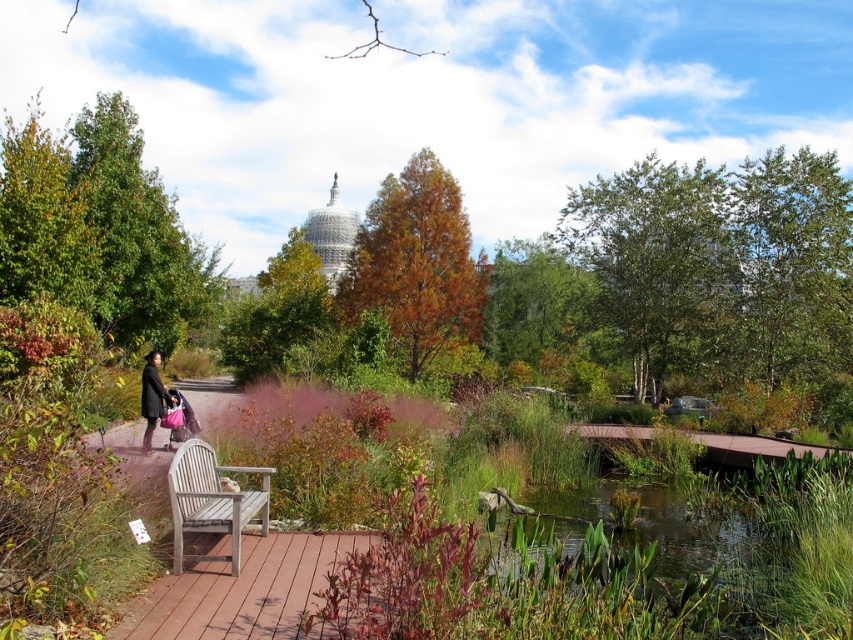
Question: In this image, where is green leafy tree at left located relative to green leafy tree at center?

Choices:
 (A) right
 (B) left

Answer: (B)

Question: Among these objects, which one is farthest from the camera?

Choices:
 (A) dark brown coat at left
 (B) green leafy pond at center
 (C) green leafy tree at center
 (D) green leafy tree at left

Answer: (C)

Question: Among these points, which one is nearest to the camera?

Choices:
 (A) (386, 228)
 (B) (787, 592)

Answer: (B)

Question: Is green leafy tree at upper right to the left of dark brown coat at left from the viewer's perspective?

Choices:
 (A) yes
 (B) no

Answer: (B)

Question: Which of these objects is positioned farthest from the dark brown coat at left?

Choices:
 (A) green leafy tree at center
 (B) green leafy pond at center
 (C) wooden bench at center
 (D) green leafy tree at left

Answer: (A)

Question: Does green leafy tree at upper right appear under dark brown coat at left?

Choices:
 (A) no
 (B) yes

Answer: (A)